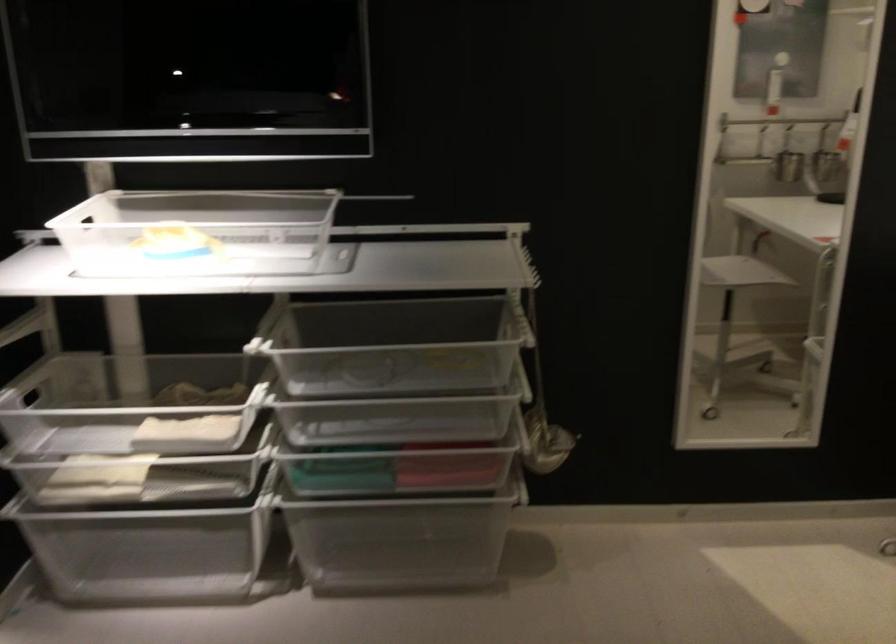
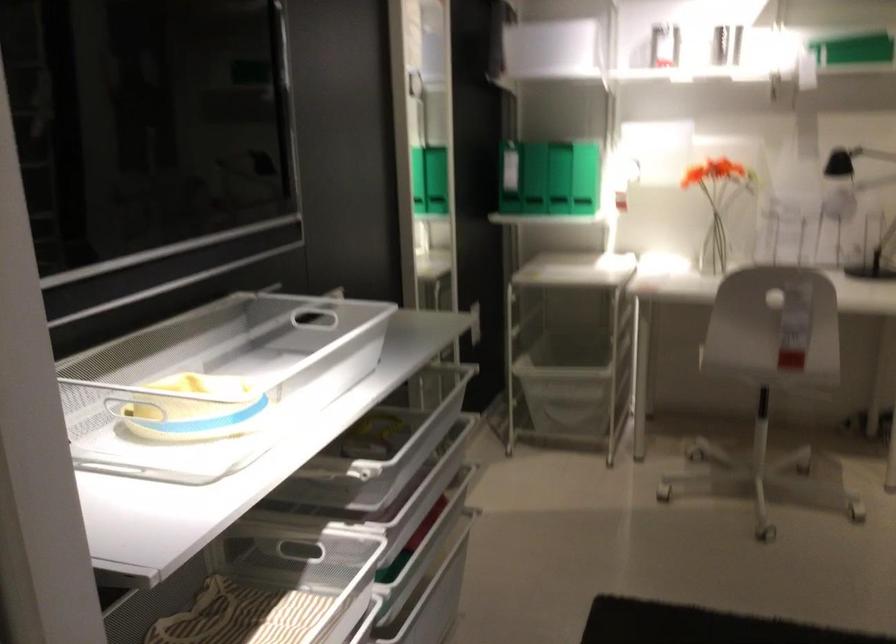
Question: I am providing you with two images of the same scene from different viewpoints. After the viewpoint changes to image2, which objects are now occluded?

Choices:
 (A) chair sitting surface
 (B) white trash bin
 (C) white mesh basket
 (D) basket handle

Answer: (D)